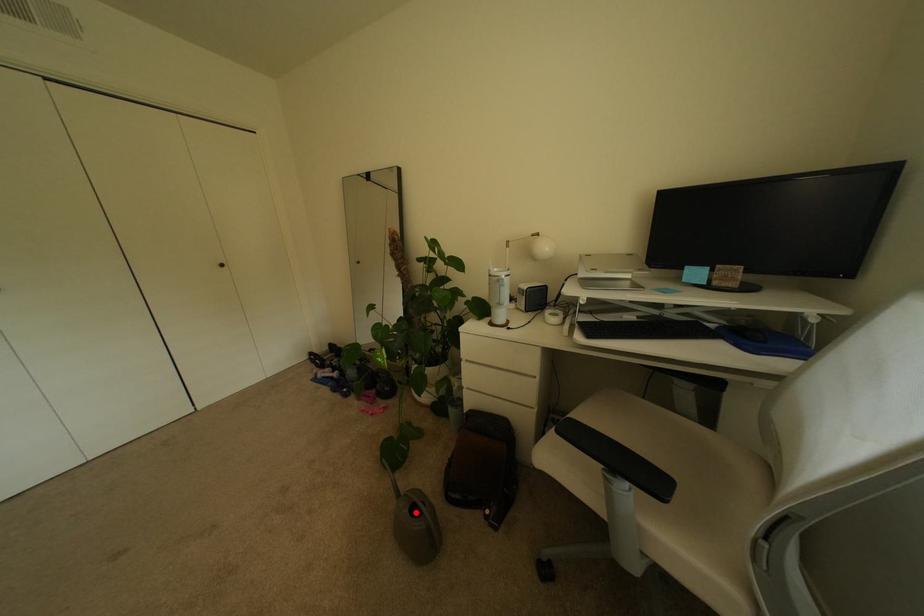
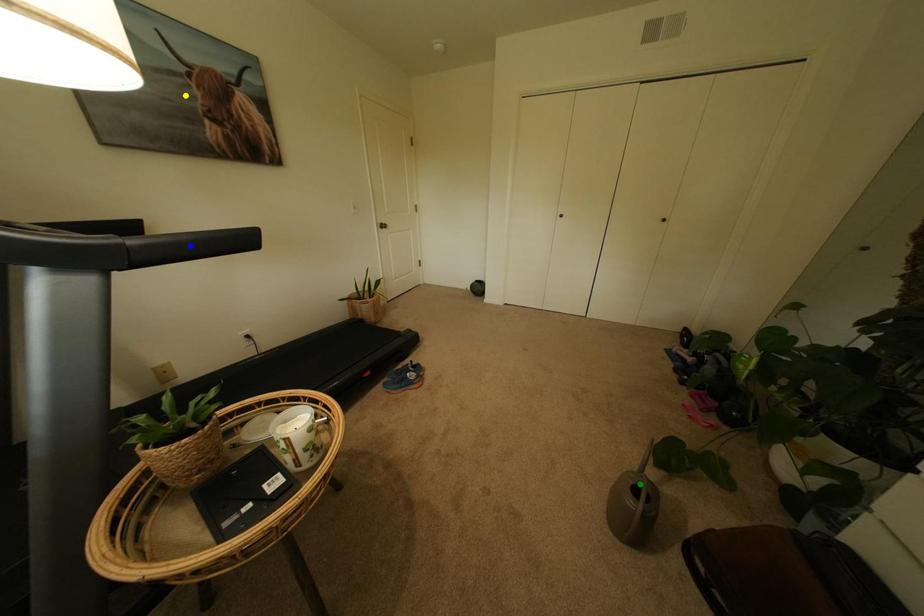
Question: I am providing you with two images of the same scene from different viewpoints. A red point is marked on the first image. You are given multiple points on the second image. Which spot in image 2 lines up with the point in image 1?

Choices:
 (A) yellow point
 (B) blue point
 (C) green point

Answer: (C)